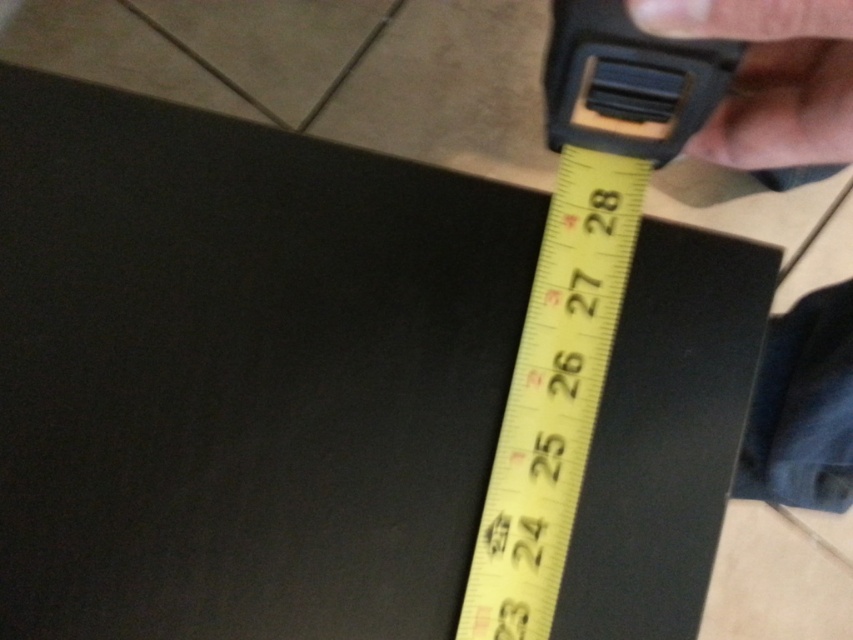
Is yellow/yellowish plastic tape measure at upper right closer to camera compared to skinny leather wristwatch at upper right?

That is False.

Does yellow/yellowish plastic tape measure at upper right appear on the left side of skinny leather wristwatch at upper right?

Indeed, yellow/yellowish plastic tape measure at upper right is positioned on the left side of skinny leather wristwatch at upper right.

The image size is (853, 640). I want to click on yellow/yellowish plastic tape measure at upper right, so click(578, 291).

Where is `skinny hand at upper right`? Image resolution: width=853 pixels, height=640 pixels. skinny hand at upper right is located at coordinates (770, 77).

How much distance is there between skinny hand at upper right and skinny leather wristwatch at upper right?

They are 16.69 inches apart.

Who is more forward, [825,49] or [759,36]?

Point [759,36] is in front.

What are the coordinates of `skinny hand at upper right` in the screenshot? It's located at (770, 77).

Measure the distance between point [692,131] and camera.

The distance of point [692,131] from camera is 16.25 inches.

Is point (488, 548) more distant than point (743, 61)?

Yes, point (488, 548) is behind point (743, 61).

This screenshot has width=853, height=640. I want to click on yellow/yellowish plastic tape measure at upper right, so click(578, 291).